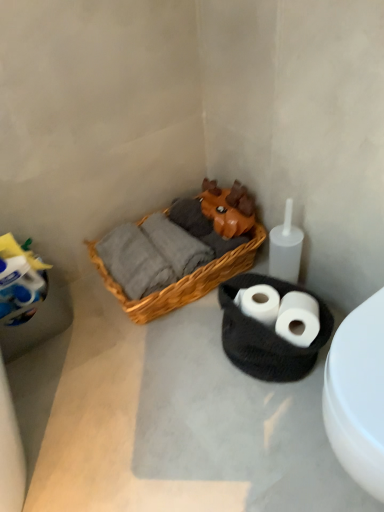
Question: From a real-world perspective, relative to woven wood picnic basket at center, is white matte toilet at lower right vertically above or below?

Choices:
 (A) below
 (B) above

Answer: (B)

Question: Is white matte toilet at lower right inside or outside of woven wood picnic basket at center?

Choices:
 (A) inside
 (B) outside

Answer: (B)

Question: Estimate the real-world distances between objects in this image. Which object is farther from the white matte toilet paper at center, the second toilet paper positioned from the right?

Choices:
 (A) white matte toilet paper at lower right, which is counted as the 1th toilet paper, starting from the right
 (B) white matte toilet at lower right
 (C) woven basket at center
 (D) woven wood picnic basket at center

Answer: (B)

Question: Which is nearer to the white matte toilet at lower right?

Choices:
 (A) woven basket at center
 (B) woven wood picnic basket at center
 (C) white matte toilet paper at lower right, which is counted as the 1th toilet paper, starting from the right
 (D) white matte toilet paper at center, the 1th toilet paper from the left

Answer: (C)